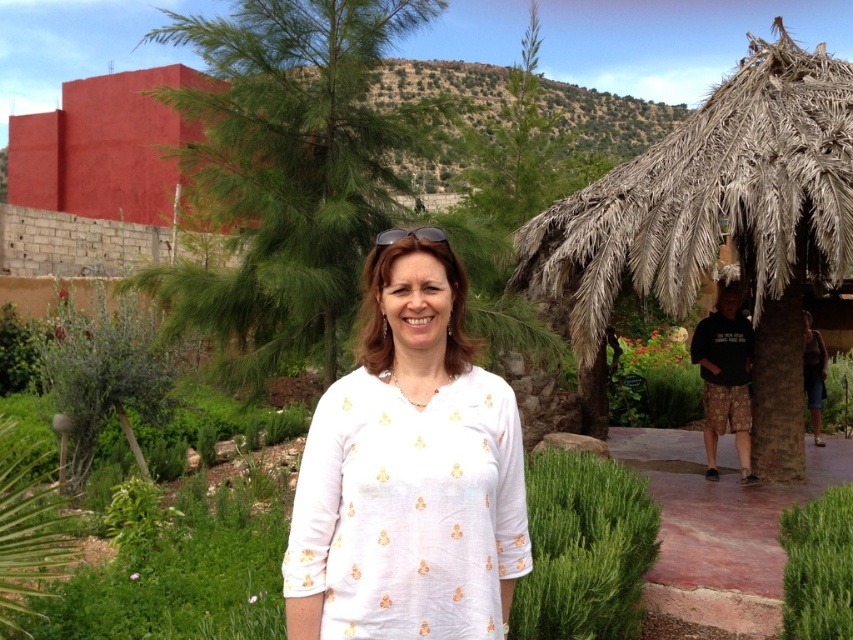
Looking at this image, does white cotton blouse at center come behind clear plastic goggles at center?

Yes, it is.

Which is in front, point (815, 340) or point (408, 230)?

Point (408, 230)

Find the location of a particular element. This screenshot has height=640, width=853. white cotton blouse at center is located at coordinates (813, 374).

Is thatched palm hut at right to the right of green leafy bush at lower right from the viewer's perspective?

Yes, thatched palm hut at right is to the right of green leafy bush at lower right.

Does thatched palm hut at right have a lesser width compared to green leafy bush at lower right?

In fact, thatched palm hut at right might be wider than green leafy bush at lower right.

You are a GUI agent. You are given a task and a screenshot of the screen. Output one action in this format:
    pyautogui.click(x=<x>, y=<y>)
    Task: Click on the thatched palm hut at right
    Image resolution: width=853 pixels, height=640 pixels.
    Given the screenshot: What is the action you would take?
    pyautogui.click(x=718, y=221)

Can you confirm if white printed blouse at center is positioned to the left of black cotton shorts at right?

Correct, you'll find white printed blouse at center to the left of black cotton shorts at right.

Does point (369, 484) lie in front of point (700, 326)?

Yes, it is in front of point (700, 326).

Which is behind, point (343, 582) or point (729, 412)?

The point (729, 412) is behind.

Find the location of a particular element. white printed blouse at center is located at coordinates (409, 472).